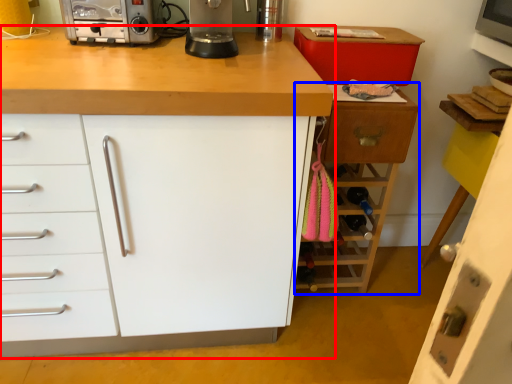
Question: Among these objects, which one is farthest to the camera, cabinetry (highlighted by a red box) or cabinetry (highlighted by a blue box)?

Choices:
 (A) cabinetry
 (B) cabinetry

Answer: (B)